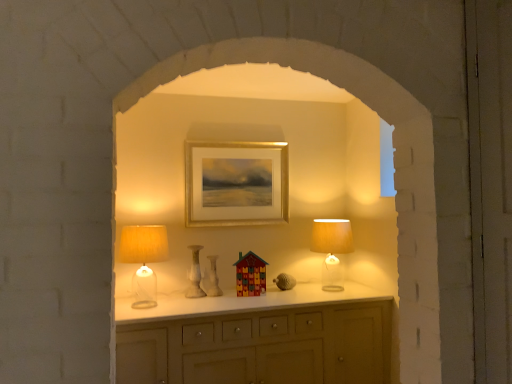
Question: Which direction should I rotate to look at white marble vase at center, which is the 1th vase from left to right?

Choices:
 (A) right
 (B) left

Answer: (B)

Question: Can you confirm if wooden multicolored house at center is thinner than matte yellow fabric lampshade at left, which is the second table lamp from back to front?

Choices:
 (A) yes
 (B) no

Answer: (A)

Question: Is wooden multicolored house at center in front of matte yellow fabric lampshade at left, the first table lamp when ordered from front to back?

Choices:
 (A) no
 (B) yes

Answer: (A)

Question: Is wooden multicolored house at center not within matte yellow fabric lampshade at left, the first table lamp positioned from the left?

Choices:
 (A) yes
 (B) no

Answer: (A)

Question: From the image's perspective, would you say wooden multicolored house at center is shown under matte yellow fabric lampshade at left, which is the second table lamp from back to front?

Choices:
 (A) no
 (B) yes

Answer: (B)

Question: Is wooden multicolored house at center taller than matte yellow fabric lampshade at left, which ranks as the second table lamp in right-to-left order?

Choices:
 (A) yes
 (B) no

Answer: (B)

Question: Is wooden multicolored house at center at the right side of matte yellow fabric lampshade at left, which ranks as the second table lamp in right-to-left order?

Choices:
 (A) no
 (B) yes

Answer: (B)

Question: From a real-world perspective, is wooden multicolored house at center positioned under translucent glass table lamp at right, acting as the first table lamp starting from the back, based on gravity?

Choices:
 (A) yes
 (B) no

Answer: (A)

Question: Is wooden multicolored house at center positioned beyond the bounds of translucent glass table lamp at right, the 1th table lamp in the right-to-left sequence?

Choices:
 (A) no
 (B) yes

Answer: (B)

Question: Can you confirm if wooden multicolored house at center is wider than translucent glass table lamp at right, acting as the first table lamp starting from the back?

Choices:
 (A) yes
 (B) no

Answer: (B)

Question: From the image's perspective, is wooden multicolored house at center over translucent glass table lamp at right, which appears as the second table lamp when viewed from the front?

Choices:
 (A) no
 (B) yes

Answer: (A)

Question: Is wooden multicolored house at center at the right side of translucent glass table lamp at right, acting as the first table lamp starting from the back?

Choices:
 (A) yes
 (B) no

Answer: (B)

Question: Can you confirm if wooden multicolored house at center is positioned to the left of translucent glass table lamp at right, acting as the first table lamp starting from the back?

Choices:
 (A) no
 (B) yes

Answer: (B)

Question: Does translucent glass table lamp at right, acting as the first table lamp starting from the back, have a lesser width compared to white glossy vase at center, acting as the second vase starting from the left?

Choices:
 (A) no
 (B) yes

Answer: (A)